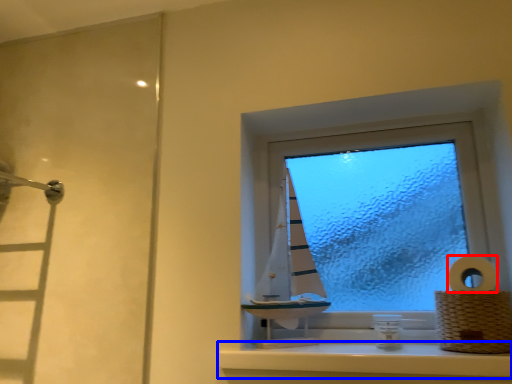
Question: Which point is closer to the camera, toilet paper (highlighted by a red box) or window sill (highlighted by a blue box)?

Choices:
 (A) toilet paper
 (B) window sill

Answer: (B)